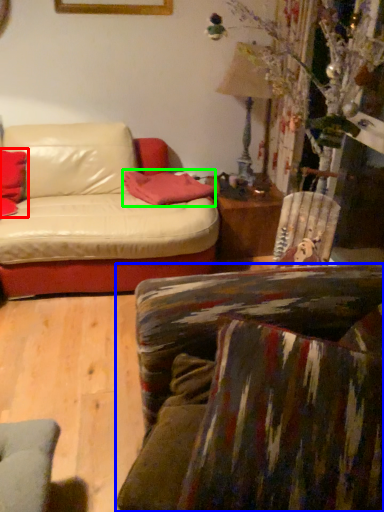
Question: Based on their relative distances, which object is farther from pillow (highlighted by a red box)? Choose from studio couch (highlighted by a blue box) and pillow (highlighted by a green box).

Choices:
 (A) studio couch
 (B) pillow

Answer: (A)